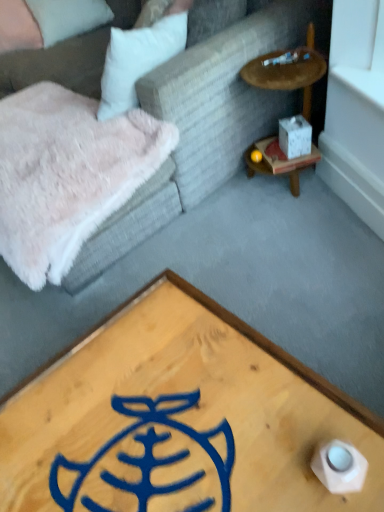
What are the coordinates of `vacant space situated above wooden coffee table at center (from a real-world perspective)` in the screenshot? It's located at (147, 429).